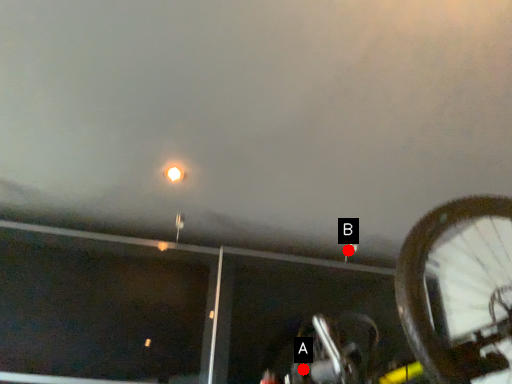
Question: Two points are circled on the image, labeled by A and B beside each circle. Which of the following is the closest to the observer?

Choices:
 (A) A is closer
 (B) B is closer

Answer: (A)